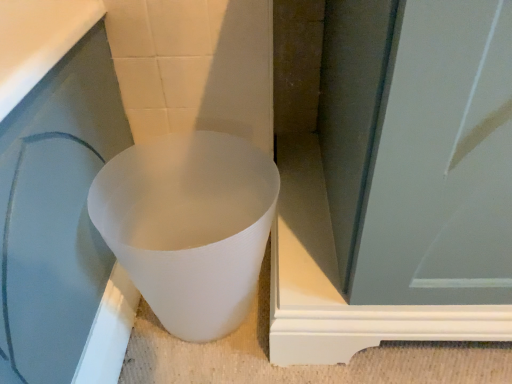
Image resolution: width=512 pixels, height=384 pixels. Identify the location of white matte screen door at center. (442, 161).

This screenshot has height=384, width=512. What do you see at coordinates (442, 161) in the screenshot? I see `white matte screen door at center` at bounding box center [442, 161].

What do you see at coordinates (189, 226) in the screenshot?
I see `white matte plastic cup at lower left` at bounding box center [189, 226].

You are a GUI agent. You are given a task and a screenshot of the screen. Output one action in this format:
    pyautogui.click(x=<x>, y=<y>)
    Task: Click on the white matte plastic cup at lower left
    This screenshot has width=512, height=384.
    Given the screenshot: What is the action you would take?
    (x=189, y=226)

Find the location of a particular element. The width and height of the screenshot is (512, 384). white matte screen door at center is located at coordinates (442, 161).

Considering the positions of objects white matte plastic cup at lower left and white matte screen door at center in the image provided, who is more to the right, white matte plastic cup at lower left or white matte screen door at center?

white matte screen door at center is more to the right.

In the image, is white matte plastic cup at lower left positioned in front of or behind white matte screen door at center?

Clearly, white matte plastic cup at lower left is behind white matte screen door at center.

Which is farther, (136, 205) or (479, 181)?

The point (136, 205) is farther.

From the image's perspective, does white matte plastic cup at lower left appear lower than white matte screen door at center?

Indeed, from the image's perspective, white matte plastic cup at lower left is shown beneath white matte screen door at center.

From a real-world perspective, is white matte plastic cup at lower left under white matte screen door at center?

Yes, from a real-world perspective, white matte plastic cup at lower left is under white matte screen door at center.

Can you confirm if white matte plastic cup at lower left is wider than white matte screen door at center?

No.

Which of these two, white matte plastic cup at lower left or white matte screen door at center, stands shorter?

Standing shorter between the two is white matte plastic cup at lower left.

Considering the sizes of white matte plastic cup at lower left and white matte screen door at center in the image, is white matte plastic cup at lower left bigger or smaller than white matte screen door at center?

Considering their sizes, white matte plastic cup at lower left takes up less space than white matte screen door at center.

Do you think white matte plastic cup at lower left is within white matte screen door at center, or outside of it?

white matte plastic cup at lower left is located beyond the bounds of white matte screen door at center.

Would you consider white matte plastic cup at lower left to be distant from white matte screen door at center?

white matte plastic cup at lower left is actually quite close to white matte screen door at center.

Is white matte plastic cup at lower left oriented towards white matte screen door at center?

No, white matte plastic cup at lower left is not oriented towards white matte screen door at center.

How different are the orientations of white matte plastic cup at lower left and white matte screen door at center in degrees?

0.851 degrees.

Find the location of a particular element. The width and height of the screenshot is (512, 384). screen door that appears above the white matte plastic cup at lower left (from a real-world perspective) is located at coordinates (442, 161).

Considering the positions of objects white matte screen door at center and white matte plastic cup at lower left in the image provided, who is more to the left, white matte screen door at center or white matte plastic cup at lower left?

white matte plastic cup at lower left is more to the left.

Is white matte screen door at center positioned in front of white matte plastic cup at lower left?

Yes, white matte screen door at center is closer to the viewer.

Between point (478, 160) and point (185, 208), which one is positioned in front?

Positioned in front is point (478, 160).

From the image's perspective, which one is positioned higher, white matte screen door at center or white matte plastic cup at lower left?

white matte screen door at center.

From a real-world perspective, between white matte screen door at center and white matte plastic cup at lower left, who is vertically lower?

white matte plastic cup at lower left, from a real-world perspective.

Looking at their sizes, would you say white matte screen door at center is wider or thinner than white matte plastic cup at lower left?

In the image, white matte screen door at center appears to be wider than white matte plastic cup at lower left.

Between white matte screen door at center and white matte plastic cup at lower left, which one has less height?

Standing shorter between the two is white matte plastic cup at lower left.

Which of these two, white matte screen door at center or white matte plastic cup at lower left, is bigger?

Bigger between the two is white matte screen door at center.

Is white matte plastic cup at lower left located within white matte screen door at center?

No, white matte plastic cup at lower left is not a part of white matte screen door at center.

Would you say white matte screen door at center is a long distance from white matte plastic cup at lower left?

No, white matte screen door at center is in close proximity to white matte plastic cup at lower left.

Is white matte screen door at center oriented towards white matte plastic cup at lower left?

No, white matte screen door at center is not turned towards white matte plastic cup at lower left.

At what (x,y) coordinates should I click in order to perform the action: click on toilet on the left of white matte screen door at center. Please return your answer as a coordinate pair (x, y). This screenshot has height=384, width=512. Looking at the image, I should click on (189, 226).

There is a white matte plastic cup at lower left. Where is `screen door above it (from a real-world perspective)`? Image resolution: width=512 pixels, height=384 pixels. screen door above it (from a real-world perspective) is located at coordinates (442, 161).

Find the location of a particular element. This screenshot has width=512, height=384. screen door above the white matte plastic cup at lower left (from the image's perspective) is located at coordinates (442, 161).